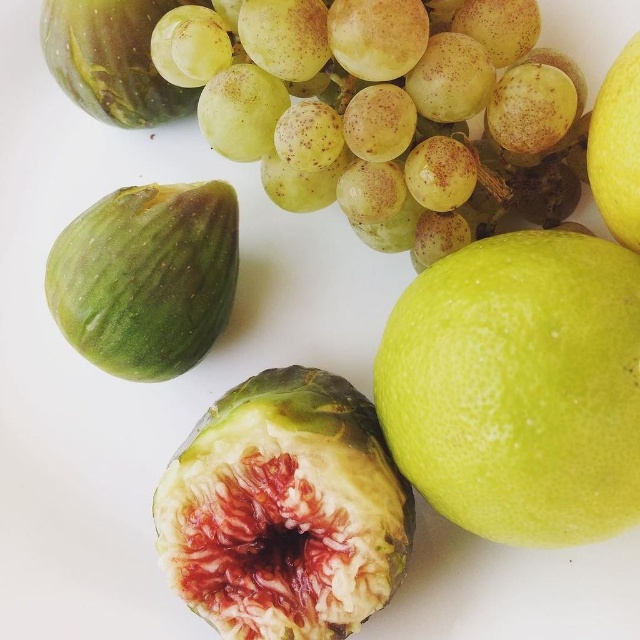
You are a food stylist arranging fruits for a photo shoot. You have a green matte grape at upper center and a cut fig on the right. The distance between them is 1.15 meters. If you want to place a decorative plate between them, what is the minimum length the plate should be to span the gap?

The minimum length the plate should be is 1.15 meters to span the gap between the green matte grape at upper center and the cut fig on the right.

You are standing in front of the fruit arrangement and want to pick up the item closest to you. Which point should you reach for, point 1 at (310,605) or point 2 at (612,161)?

You should reach for point 1 at (310,605) because it is closer to you than point 2 at (612,161).